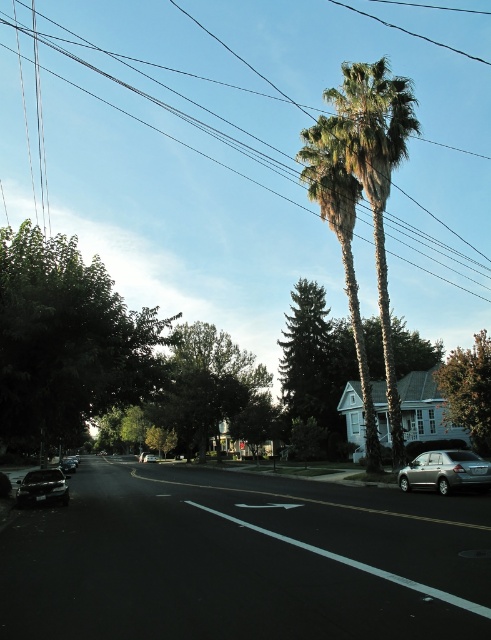
Question: Which object appears closest to the camera in this image?

Choices:
 (A) shiny black sedan at lower left
 (B) satin silver sedan at lower right
 (C) green textured tree at right

Answer: (B)

Question: Can you confirm if green leafy tree at left is positioned to the right of shiny black sedan at lower left?

Choices:
 (A) yes
 (B) no

Answer: (B)

Question: In this image, where is green leafy tree at left located relative to green textured tree at right?

Choices:
 (A) below
 (B) above

Answer: (B)

Question: Which point appears closest to the camera in this image?

Choices:
 (A) (143, 456)
 (B) (380, 113)
 (C) (103, 340)
 (D) (453, 376)

Answer: (C)

Question: Does green leafy palm trees at upper right appear on the left side of satin silver sedan at lower right?

Choices:
 (A) yes
 (B) no

Answer: (B)

Question: Estimate the real-world distances between objects in this image. Which object is closer to the satin silver sedan at lower right?

Choices:
 (A) green leafy tree at center
 (B) black wire at upper center
 (C) green textured tree at right

Answer: (C)